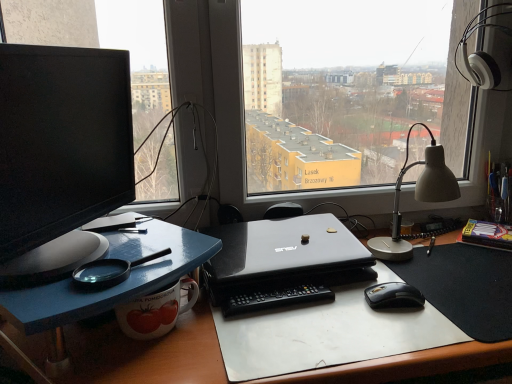
Question: Is black plastic remote control at center located outside black glossy mouse at lower right?

Choices:
 (A) yes
 (B) no

Answer: (A)

Question: Is black plastic remote control at center at the right side of black glossy mouse at lower right?

Choices:
 (A) no
 (B) yes

Answer: (A)

Question: Is black glossy mouse at lower right located within black plastic remote control at center?

Choices:
 (A) no
 (B) yes

Answer: (A)

Question: Is black plastic remote control at center facing away from black glossy mouse at lower right?

Choices:
 (A) yes
 (B) no

Answer: (B)

Question: Is black plastic remote control at center in front of black glossy mouse at lower right?

Choices:
 (A) no
 (B) yes

Answer: (B)

Question: Is black plastic remote control at center positioned behind black glossy mouse at lower right?

Choices:
 (A) no
 (B) yes

Answer: (A)

Question: Is white plastic notepad at right inside black glossy mouse at lower right?

Choices:
 (A) no
 (B) yes

Answer: (A)

Question: Is black glossy mouse at lower right not close to white plastic notepad at right?

Choices:
 (A) no
 (B) yes

Answer: (A)

Question: Considering the relative positions of black glossy mouse at lower right and white plastic notepad at right in the image provided, is black glossy mouse at lower right behind white plastic notepad at right?

Choices:
 (A) no
 (B) yes

Answer: (A)

Question: From the image's perspective, is black glossy mouse at lower right on white plastic notepad at right?

Choices:
 (A) no
 (B) yes

Answer: (A)

Question: From a real-world perspective, is black glossy mouse at lower right physically above white plastic notepad at right?

Choices:
 (A) yes
 (B) no

Answer: (B)

Question: From the image's perspective, is black glossy mouse at lower right located beneath white plastic notepad at right?

Choices:
 (A) no
 (B) yes

Answer: (B)

Question: Is matte black monitor at left not inside black matte laptop at center?

Choices:
 (A) yes
 (B) no

Answer: (A)